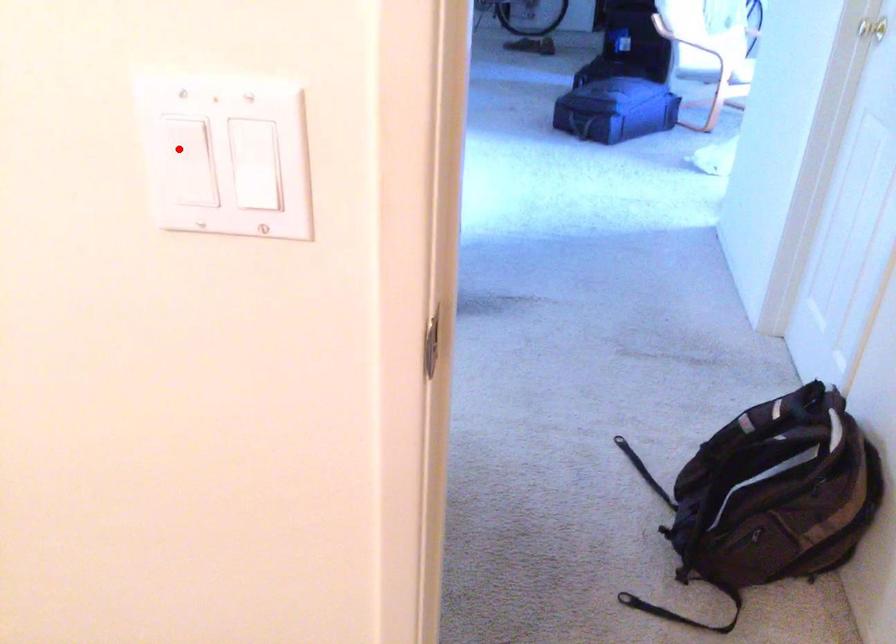
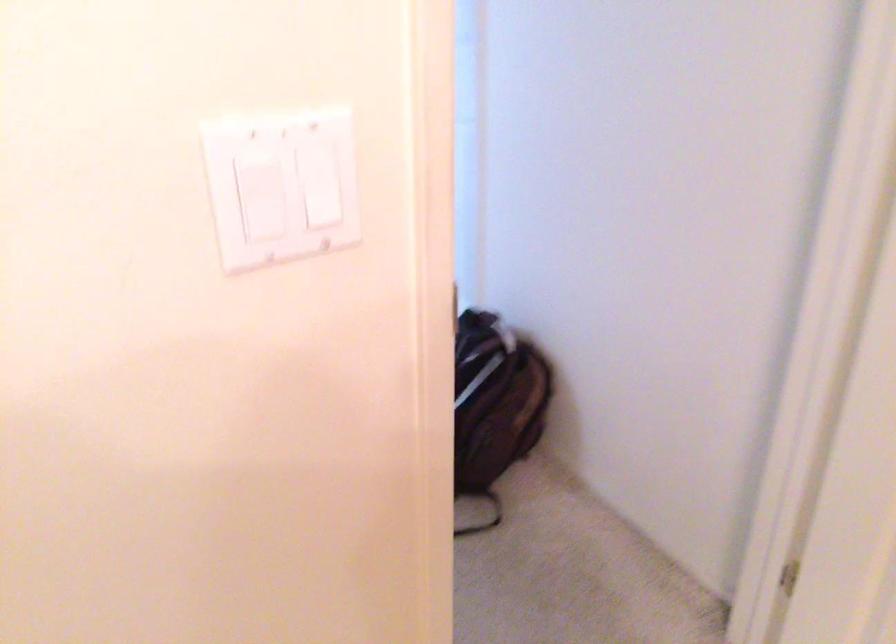
Question: I am providing you with two images of the same scene from different viewpoints. A red point is marked on the first image. Is the red point's position out of view in image 2?

Choices:
 (A) Yes
 (B) No

Answer: (B)